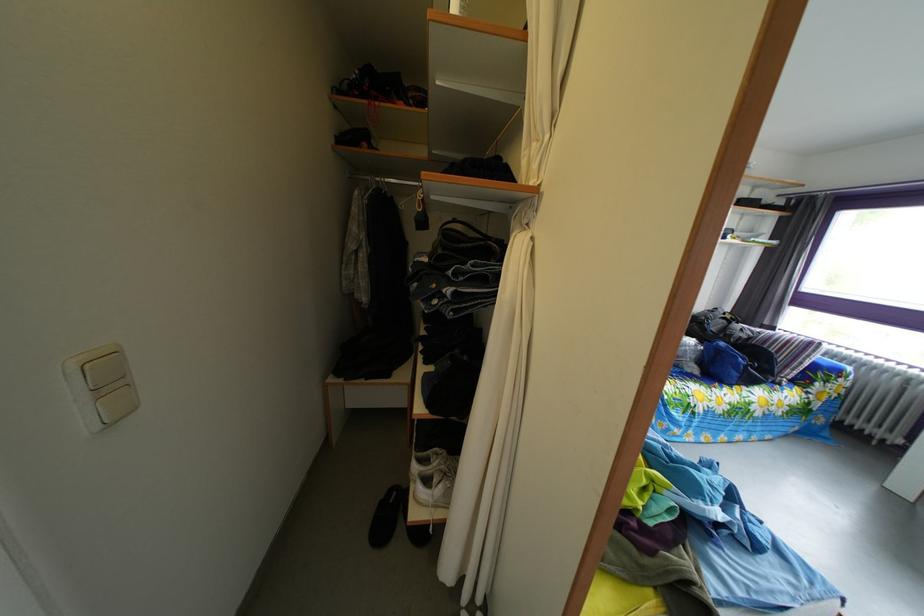
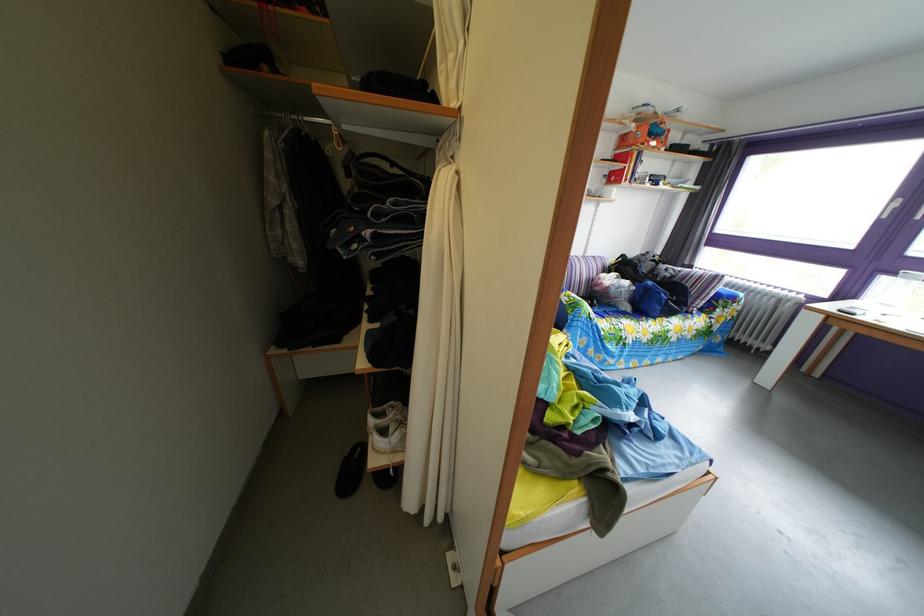
In the second image, find the point that corresponds to [394,513] in the first image.

(359, 469)